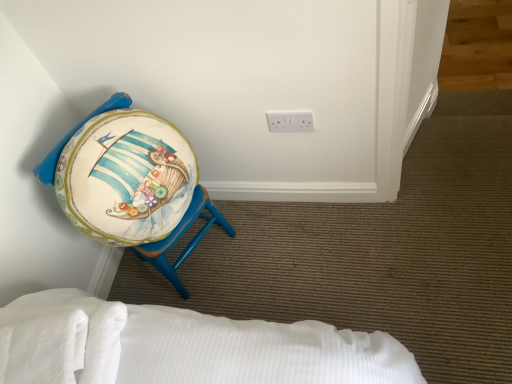
This screenshot has width=512, height=384. What are the coordinates of `white plastic electric outlet at upper center` in the screenshot? It's located at (290, 121).

The width and height of the screenshot is (512, 384). I want to click on white soft towel at lower left, so click(x=66, y=342).

From the image's perspective, which is above, white soft towel at lower left or white plastic electric outlet at upper center?

From the image's view, white plastic electric outlet at upper center is above.

Which object is thinner, white soft towel at lower left or white plastic electric outlet at upper center?

With smaller width is white plastic electric outlet at upper center.

From a real-world perspective, is white soft towel at lower left physically below white plastic electric outlet at upper center?

No.

Considering the relative sizes of white soft towel at lower left and white plastic electric outlet at upper center in the image provided, is white soft towel at lower left taller than white plastic electric outlet at upper center?

Incorrect, the height of white soft towel at lower left is not larger of that of white plastic electric outlet at upper center.

Which is more to the right, white soft towel at lower left or matte painted stool at left?

matte painted stool at left is more to the right.

Would you consider white soft towel at lower left to be distant from matte painted stool at left?

No.

Can you tell me how much white soft towel at lower left and matte painted stool at left differ in facing direction?

They differ by 129 degrees in their facing directions.

Is matte painted stool at left at the back of white soft towel at lower left?

That's not correct — white soft towel at lower left is not looking away from matte painted stool at left.

Is white plastic electric outlet at upper center to the left or to the right of white soft towel at lower left in the image?

From the image, it's evident that white plastic electric outlet at upper center is to the right of white soft towel at lower left.

Is white soft towel at lower left surrounded by white plastic electric outlet at upper center?

No, white soft towel at lower left is not inside white plastic electric outlet at upper center.

Is point (280, 120) positioned before point (35, 355)?

No.

From a real-world perspective, is white plastic electric outlet at upper center above or below white soft towel at lower left?

white plastic electric outlet at upper center is below white soft towel at lower left.

From the image's perspective, is matte painted stool at left below white soft towel at lower left?

Actually, matte painted stool at left appears above white soft towel at lower left in the image.

Is matte painted stool at left facing towards white soft towel at lower left?

No, matte painted stool at left is not oriented towards white soft towel at lower left.

Can you confirm if matte painted stool at left is smaller than white soft towel at lower left?

Actually, matte painted stool at left might be larger than white soft towel at lower left.

From a real-world perspective, is white plastic electric outlet at upper center positioned over matte painted stool at left based on gravity?

Yes.

Is white plastic electric outlet at upper center outside of matte painted stool at left?

Yes, white plastic electric outlet at upper center is not within matte painted stool at left.

Image resolution: width=512 pixels, height=384 pixels. Find the location of `electric outlet lying above the matte painted stool at left (from the image's perspective)`. electric outlet lying above the matte painted stool at left (from the image's perspective) is located at coordinates (290, 121).

Consider the image. Considering the relative sizes of matte painted stool at left and white plastic electric outlet at upper center in the image provided, is matte painted stool at left wider than white plastic electric outlet at upper center?

Yes, matte painted stool at left is wider than white plastic electric outlet at upper center.

From the image's perspective, is matte painted stool at left positioned above or below white plastic electric outlet at upper center?

From the image's perspective, matte painted stool at left appears below white plastic electric outlet at upper center.

Considering the sizes of matte painted stool at left and white plastic electric outlet at upper center in the image, is matte painted stool at left taller or shorter than white plastic electric outlet at upper center?

Clearly, matte painted stool at left is taller compared to white plastic electric outlet at upper center.

Between point (126, 166) and point (295, 125), which one is positioned behind?

The point (295, 125) is farther.

Where is `sheet in front of the white plastic electric outlet at upper center`? sheet in front of the white plastic electric outlet at upper center is located at coordinates (66, 342).

Locate an element on the screen. sheet above the matte painted stool at left (from a real-world perspective) is located at coordinates (66, 342).

From the image, which object appears to be farther from matte painted stool at left, white plastic electric outlet at upper center or white soft towel at lower left?

white plastic electric outlet at upper center.

When comparing their distances from matte painted stool at left, does white soft towel at lower left or white plastic electric outlet at upper center seem further?

white plastic electric outlet at upper center is further to matte painted stool at left.

Estimate the real-world distances between objects in this image. Which object is closer to white soft towel at lower left, white plastic electric outlet at upper center or matte painted stool at left?

matte painted stool at left.

From the image, which object appears to be nearer to white plastic electric outlet at upper center, white soft towel at lower left or matte painted stool at left?

matte painted stool at left.

Which object lies nearer to the anchor point white soft towel at lower left, matte painted stool at left or white plastic electric outlet at upper center?

matte painted stool at left.

Estimate the real-world distances between objects in this image. Which object is further from white plastic electric outlet at upper center, matte painted stool at left or white soft towel at lower left?

white soft towel at lower left lies further to white plastic electric outlet at upper center than the other object.

Locate an element on the screen. furniture located between white soft towel at lower left and white plastic electric outlet at upper center in the left-right direction is located at coordinates (139, 174).